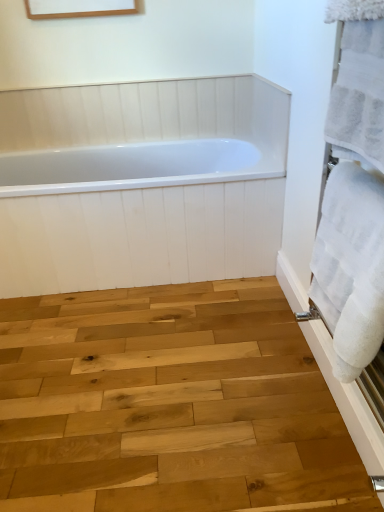
Find the location of a particular element. This screenshot has height=512, width=384. white fluffy towel at right, which is counted as the first bath towel, starting from the top is located at coordinates (359, 92).

Image resolution: width=384 pixels, height=512 pixels. I want to click on white soft towel at right, arranged as the first bath towel when ordered from the bottom, so click(x=351, y=267).

I want to click on natural wood plank at center, so click(x=169, y=404).

Which of these two, white soft towel at right, which is the 2th bath towel from top to bottom, or white glossy bathtub at center, is bigger?

white glossy bathtub at center is bigger.

Considering the positions of objects white soft towel at right, arranged as the first bath towel when ordered from the bottom, and white glossy bathtub at center in the image provided, who is behind, white soft towel at right, arranged as the first bath towel when ordered from the bottom, or white glossy bathtub at center?

Positioned behind is white glossy bathtub at center.

Between white soft towel at right, which is the 2th bath towel from top to bottom, and white glossy bathtub at center, which one has larger width?

Wider between the two is white glossy bathtub at center.

What's the angular difference between white soft towel at right, arranged as the first bath towel when ordered from the bottom, and white glossy bathtub at center's facing directions?

They differ by 90.2 degrees in their facing directions.

From the image's perspective, is white glossy bathtub at center positioned above or below white fluffy towel at right, which is counted as the first bath towel, starting from the top?

From the image's perspective, white glossy bathtub at center appears below white fluffy towel at right, which is counted as the first bath towel, starting from the top.

Considering the sizes of objects white glossy bathtub at center and white fluffy towel at right, which is counted as the first bath towel, starting from the top, in the image provided, who is smaller, white glossy bathtub at center or white fluffy towel at right, which is counted as the first bath towel, starting from the top,?

Smaller between the two is white fluffy towel at right, which is counted as the first bath towel, starting from the top.

How many degrees apart are the facing directions of white glossy bathtub at center and white fluffy towel at right, the 2th bath towel positioned from the bottom?

There is a 90.3-degree angle between the facing directions of white glossy bathtub at center and white fluffy towel at right, the 2th bath towel positioned from the bottom.

Is white glossy bathtub at center located outside white fluffy towel at right, the 2th bath towel positioned from the bottom?

Absolutely, white glossy bathtub at center is external to white fluffy towel at right, the 2th bath towel positioned from the bottom.

Does natural wood plank at center have a greater width compared to white soft towel at right, which is the 2th bath towel from top to bottom?

Yes.

Is natural wood plank at center touching white soft towel at right, which is the 2th bath towel from top to bottom?

natural wood plank at center is not next to white soft towel at right, which is the 2th bath towel from top to bottom, and they're not touching.

Looking at the image, does natural wood plank at center seem bigger or smaller compared to white soft towel at right, arranged as the first bath towel when ordered from the bottom?

Clearly, natural wood plank at center is larger in size than white soft towel at right, arranged as the first bath towel when ordered from the bottom.

Locate an element on the screen. This screenshot has height=512, width=384. bath towel behind the white fluffy towel at right, which is counted as the first bath towel, starting from the top is located at coordinates (351, 267).

Is white soft towel at right, arranged as the first bath towel when ordered from the bottom, at the back of white fluffy towel at right, the 2th bath towel positioned from the bottom?

No, white fluffy towel at right, the 2th bath towel positioned from the bottom, is not facing the opposite direction of white soft towel at right, arranged as the first bath towel when ordered from the bottom.

Who is shorter, white fluffy towel at right, the 2th bath towel positioned from the bottom, or white soft towel at right, which is the 2th bath towel from top to bottom?

Standing shorter between the two is white fluffy towel at right, the 2th bath towel positioned from the bottom.

From the image's perspective, is white fluffy towel at right, the 2th bath towel positioned from the bottom, located above or below white soft towel at right, arranged as the first bath towel when ordered from the bottom?

white fluffy towel at right, the 2th bath towel positioned from the bottom, is above white soft towel at right, arranged as the first bath towel when ordered from the bottom.

Between point (359, 180) and point (26, 456), which one is positioned in front?

Point (359, 180)

Is white soft towel at right, arranged as the first bath towel when ordered from the bottom, next to natural wood plank at center?

No, white soft towel at right, arranged as the first bath towel when ordered from the bottom, is not beside natural wood plank at center.

Measure the distance between white soft towel at right, which is the 2th bath towel from top to bottom, and natural wood plank at center.

white soft towel at right, which is the 2th bath towel from top to bottom, is 25.87 inches away from natural wood plank at center.

Considering the relative sizes of white soft towel at right, which is the 2th bath towel from top to bottom, and natural wood plank at center in the image provided, is white soft towel at right, which is the 2th bath towel from top to bottom, thinner than natural wood plank at center?

Yes, white soft towel at right, which is the 2th bath towel from top to bottom, is thinner than natural wood plank at center.

Is point (180, 429) positioned before point (5, 215)?

Yes, it is.

Measure the distance from natural wood plank at center to white glossy bathtub at center.

The distance of natural wood plank at center from white glossy bathtub at center is 1.19 meters.

From their relative heights in the image, would you say natural wood plank at center is taller or shorter than white glossy bathtub at center?

In the image, natural wood plank at center appears to be shorter than white glossy bathtub at center.

Based on the photo, between natural wood plank at center and white glossy bathtub at center, which one has smaller width?

With smaller width is white glossy bathtub at center.

Considering the sizes of white fluffy towel at right, which is counted as the first bath towel, starting from the top, and natural wood plank at center in the image, is white fluffy towel at right, which is counted as the first bath towel, starting from the top, taller or shorter than natural wood plank at center?

Considering their sizes, white fluffy towel at right, which is counted as the first bath towel, starting from the top, has more height than natural wood plank at center.

From a real-world perspective, is white fluffy towel at right, the 2th bath towel positioned from the bottom, above or below natural wood plank at center?

white fluffy towel at right, the 2th bath towel positioned from the bottom, is situated higher than natural wood plank at center in the real world.

Where is `the 1st bath towel to the right of the natural wood plank at center, counting from the anchor's position`? The height and width of the screenshot is (512, 384). the 1st bath towel to the right of the natural wood plank at center, counting from the anchor's position is located at coordinates 359,92.

Is white fluffy towel at right, the 2th bath towel positioned from the bottom, not inside natural wood plank at center?

white fluffy towel at right, the 2th bath towel positioned from the bottom, is positioned outside natural wood plank at center.

Identify the location of the 1st bath towel directly above the white glossy bathtub at center (from a real-world perspective). (351, 267).

The width and height of the screenshot is (384, 512). In order to click on bathtub below the white fluffy towel at right, which is counted as the first bath towel, starting from the top (from a real-world perspective) in this screenshot , I will do `click(141, 183)`.

Based on their spatial positions, is white glossy bathtub at center or white fluffy towel at right, which is counted as the first bath towel, starting from the top, closer to natural wood plank at center?

Based on the image, white fluffy towel at right, which is counted as the first bath towel, starting from the top, appears to be nearer to natural wood plank at center.

From the image, which object appears to be farther from white fluffy towel at right, which is counted as the first bath towel, starting from the top, white glossy bathtub at center or white soft towel at right, arranged as the first bath towel when ordered from the bottom?

Based on the image, white glossy bathtub at center appears to be further to white fluffy towel at right, which is counted as the first bath towel, starting from the top.

From the image, which object appears to be farther from white glossy bathtub at center, white soft towel at right, arranged as the first bath towel when ordered from the bottom, or natural wood plank at center?

Based on the image, white soft towel at right, arranged as the first bath towel when ordered from the bottom, appears to be further to white glossy bathtub at center.

From the image, which object appears to be farther from white soft towel at right, which is the 2th bath towel from top to bottom, natural wood plank at center or white glossy bathtub at center?

The object further to white soft towel at right, which is the 2th bath towel from top to bottom, is white glossy bathtub at center.

Looking at the image, which one is located further to natural wood plank at center, white glossy bathtub at center or white soft towel at right, arranged as the first bath towel when ordered from the bottom?

white glossy bathtub at center.

Based on their spatial positions, is white fluffy towel at right, the 2th bath towel positioned from the bottom, or white soft towel at right, which is the 2th bath towel from top to bottom, closer to white glossy bathtub at center?

white soft towel at right, which is the 2th bath towel from top to bottom, is positioned closer to the anchor white glossy bathtub at center.

When comparing their distances from white fluffy towel at right, which is counted as the first bath towel, starting from the top, does natural wood plank at center or white soft towel at right, arranged as the first bath towel when ordered from the bottom, seem closer?

Among the two, white soft towel at right, arranged as the first bath towel when ordered from the bottom, is located nearer to white fluffy towel at right, which is counted as the first bath towel, starting from the top.

When comparing their distances from white soft towel at right, arranged as the first bath towel when ordered from the bottom, does white glossy bathtub at center or white fluffy towel at right, which is counted as the first bath towel, starting from the top, seem further?

Based on the image, white glossy bathtub at center appears to be further to white soft towel at right, arranged as the first bath towel when ordered from the bottom.

The width and height of the screenshot is (384, 512). Identify the location of plank between white soft towel at right, arranged as the first bath towel when ordered from the bottom, and white glossy bathtub at center from front to back. (169, 404).

The height and width of the screenshot is (512, 384). In order to click on plank between white fluffy towel at right, the 2th bath towel positioned from the bottom, and white glossy bathtub at center, along the z-axis in this screenshot , I will do `click(169, 404)`.

The height and width of the screenshot is (512, 384). Find the location of `bath towel between white fluffy towel at right, which is counted as the first bath towel, starting from the top, and white glossy bathtub at center, along the z-axis`. bath towel between white fluffy towel at right, which is counted as the first bath towel, starting from the top, and white glossy bathtub at center, along the z-axis is located at coordinates (351, 267).

Locate an element on the screen. This screenshot has height=512, width=384. bath towel between white fluffy towel at right, the 2th bath towel positioned from the bottom, and natural wood plank at center from top to bottom is located at coordinates (351, 267).